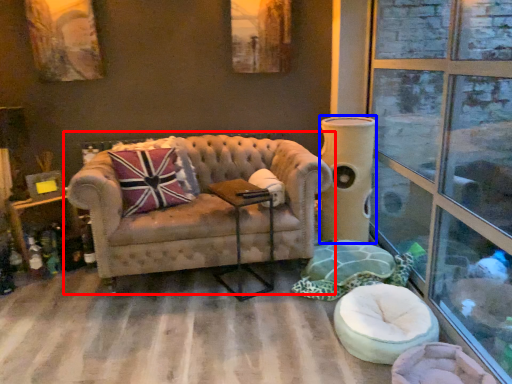
Question: Which point is further to the camera, studio couch (highlighted by a red box) or pillar (highlighted by a blue box)?

Choices:
 (A) studio couch
 (B) pillar

Answer: (B)